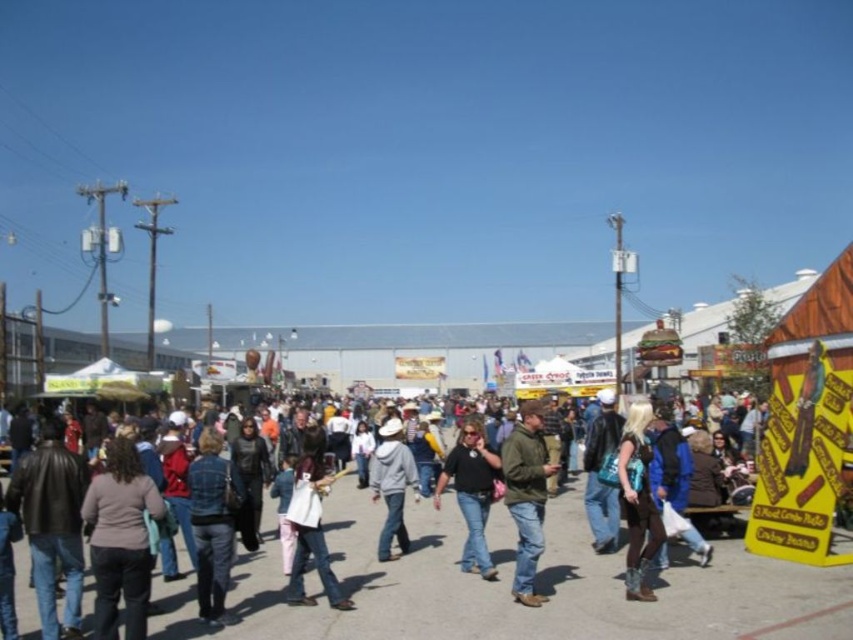
You are standing at the fair and want to take a photo of both the yellow sign and the distant food stand. The yellow sign is located at point (349, 540) and the food stand is at point (524, 554). Which point should you stand closer to ensure both are in the frame?

You should stand closer to point (349, 540) because it is closer to the camera than point (524, 554), allowing both to be captured in the photo.

You are at the fair and need to decide which item to pick up first. Both the denim jeans at center and the green matte jacket at center are on the ground. Which one has a wider width?

The denim jeans at center has a larger width than the green matte jacket at center, so pick up the denim jeans at center first.